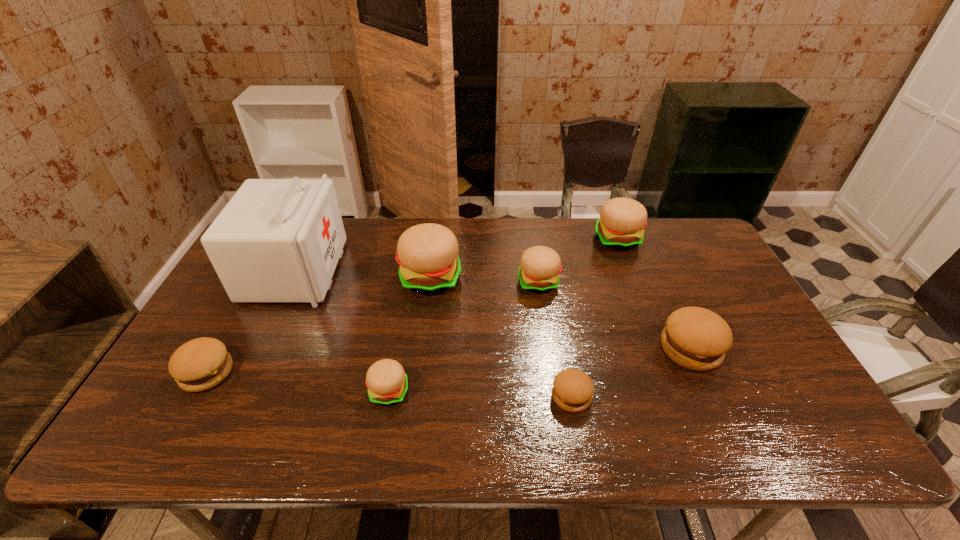
Where is `the tallest object`? The width and height of the screenshot is (960, 540). the tallest object is located at coordinates (277, 240).

Find the location of a particular element. white first-aid kit is located at coordinates (277, 240).

Find the location of a particular element. The height and width of the screenshot is (540, 960). the seventh shortest object is located at coordinates (427, 254).

Identify the location of the biggest beige hamburger. (427, 254).

Find the location of a particular element. Image resolution: width=960 pixels, height=540 pixels. the rightmost beige hamburger is located at coordinates click(621, 225).

Where is `the second tallest hamburger`? Image resolution: width=960 pixels, height=540 pixels. the second tallest hamburger is located at coordinates (621, 225).

What are the coordinates of `the third beige hamburger from left to right` in the screenshot? It's located at tap(540, 266).

You are a GUI agent. You are given a task and a screenshot of the screen. Output one action in this format:
    pyautogui.click(x=<x>, y=<y>)
    Task: Click on the biggest brown hamburger
    The height and width of the screenshot is (540, 960).
    Given the screenshot: What is the action you would take?
    pyautogui.click(x=696, y=338)

Find the location of a particular element. Image resolution: width=960 pixels, height=540 pixels. the leftmost hamburger is located at coordinates (x=202, y=363).

Where is `the leftmost brown hamburger`? This screenshot has width=960, height=540. the leftmost brown hamburger is located at coordinates [202, 363].